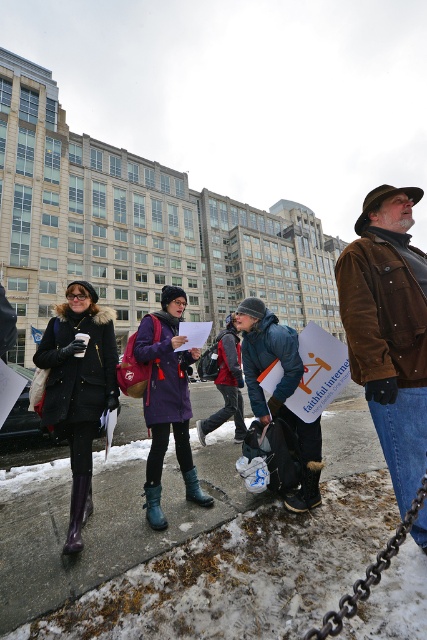
Question: Is brown suede jacket at right thinner than black metal chain at lower right?

Choices:
 (A) no
 (B) yes

Answer: (B)

Question: Is brown suede jacket at right below purple matte coat at center?

Choices:
 (A) yes
 (B) no

Answer: (B)

Question: Can you confirm if purple matte coat at center is positioned to the left of black metal chain at lower right?

Choices:
 (A) yes
 (B) no

Answer: (A)

Question: Which is farther from the brown suede jacket at right?

Choices:
 (A) black metal chain at lower right
 (B) blue denim jacket at center

Answer: (B)

Question: Which object is the closest to the blue denim jacket at center?

Choices:
 (A) brown suede jacket at right
 (B) black metal chain at lower right
 (C) purple matte coat at center

Answer: (C)

Question: Considering the real-world distances, which object is closest to the blue denim jacket at center?

Choices:
 (A) brown suede jacket at right
 (B) purple matte coat at center

Answer: (B)